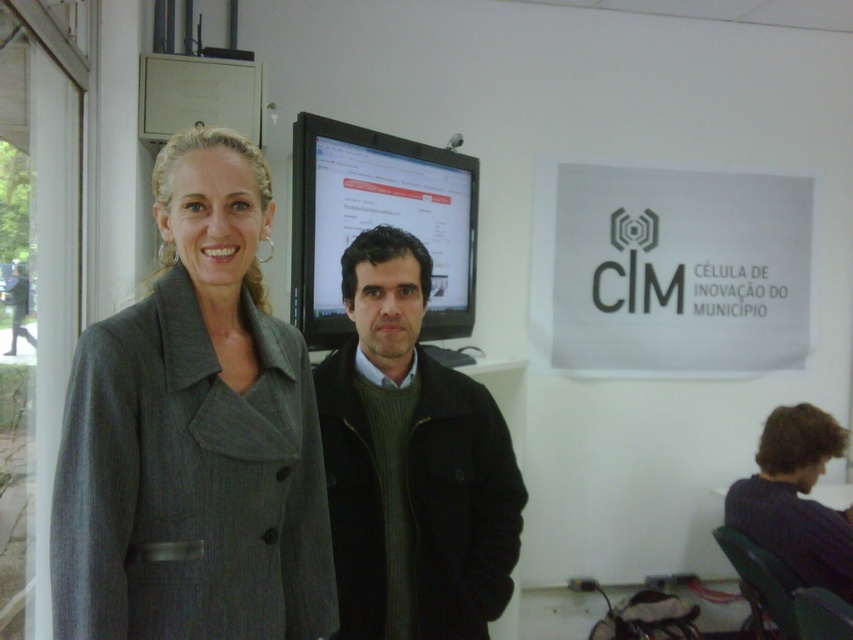
Question: Is gray woolen coat at center to the left of matte black monitor at center from the viewer's perspective?

Choices:
 (A) no
 (B) yes

Answer: (B)

Question: Which point is closer to the camera?

Choices:
 (A) pyautogui.click(x=410, y=458)
 (B) pyautogui.click(x=328, y=214)

Answer: (A)

Question: Observing the image, what is the correct spatial positioning of dark green sweater at center in reference to matte black monitor at center?

Choices:
 (A) below
 (B) above

Answer: (A)

Question: Is gray woolen coat at center below dark green sweater at center?

Choices:
 (A) no
 (B) yes

Answer: (A)

Question: Which point appears farthest from the camera in this image?

Choices:
 (A) (372, 256)
 (B) (248, 396)
 (C) (370, 157)

Answer: (C)

Question: Which object is farther from the camera taking this photo?

Choices:
 (A) gray woolen coat at center
 (B) dark green sweater at center
 (C) matte black monitor at center

Answer: (C)